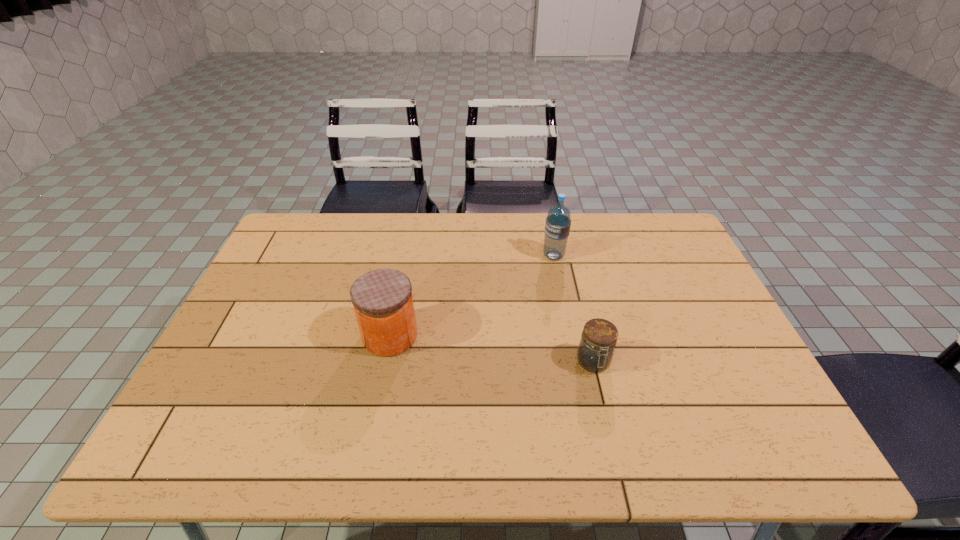
Locate an element on the screen. vacant space at the far edge of the desktop is located at coordinates (617, 226).

Identify the location of vacant area at the near edge of the desktop. Image resolution: width=960 pixels, height=540 pixels. (665, 442).

You are a GUI agent. You are given a task and a screenshot of the screen. Output one action in this format:
    pyautogui.click(x=<x>, y=<y>)
    Task: Click on the vacant region at the left edge of the desktop
    The width and height of the screenshot is (960, 540).
    Given the screenshot: What is the action you would take?
    pyautogui.click(x=276, y=284)

The width and height of the screenshot is (960, 540). In order to click on free space at the right edge in this screenshot , I will do `click(657, 258)`.

In the image, there is a desktop. Identify the location of vacant space at the far left corner. Image resolution: width=960 pixels, height=540 pixels. (287, 242).

Identify the location of vacant area at the near left corner. The height and width of the screenshot is (540, 960). (207, 456).

In the image, there is a desktop. Where is `vacant region at the far right corner`? The width and height of the screenshot is (960, 540). vacant region at the far right corner is located at coordinates (645, 215).

Where is `blank space at the near right corner of the desktop`? The width and height of the screenshot is (960, 540). blank space at the near right corner of the desktop is located at coordinates (777, 463).

Locate an element on the screen. The image size is (960, 540). free spot between the water bottle and the second shortest object is located at coordinates (472, 296).

Find the location of `vacant region between the second tallest object and the farthest object`. vacant region between the second tallest object and the farthest object is located at coordinates (472, 296).